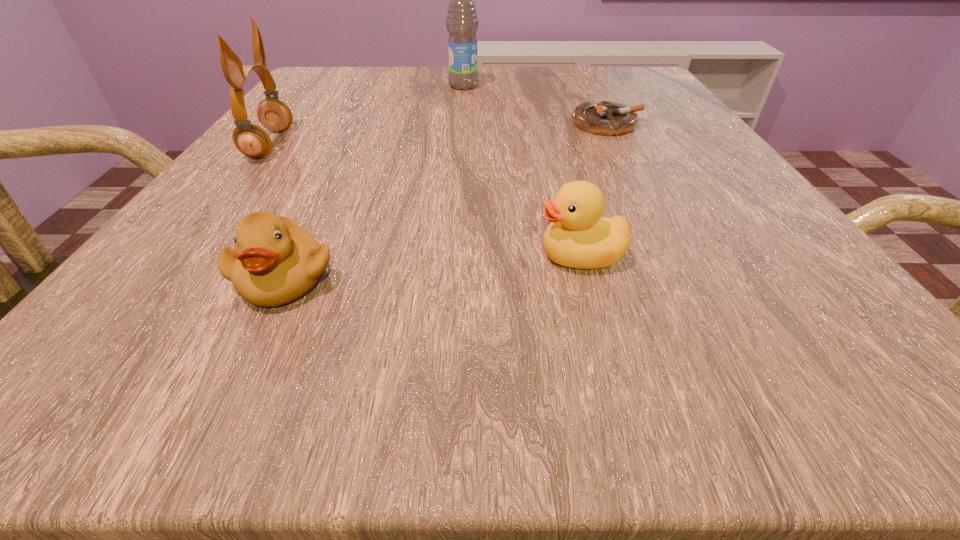
Find the location of a particular element. This screenshot has height=540, width=960. vacant space at the right edge of the desktop is located at coordinates click(730, 167).

I want to click on vacant space at the far right corner, so click(616, 76).

This screenshot has height=540, width=960. Identify the location of free spot at the near right corner of the desktop. (729, 339).

Locate an element on the screen. The image size is (960, 540). vacant space that is in between the duckling and the leftmost object is located at coordinates (276, 211).

You are a GUI agent. You are given a task and a screenshot of the screen. Output one action in this format:
    pyautogui.click(x=<x>, y=<y>)
    Task: Click on the vacant point located between the duck and the earphone
    This screenshot has height=540, width=960.
    Given the screenshot: What is the action you would take?
    pyautogui.click(x=425, y=200)

What are the coordinates of `vacant area that lies between the third object from left to right and the duck` in the screenshot? It's located at pyautogui.click(x=521, y=171).

Locate an element on the screen. The height and width of the screenshot is (540, 960). blank region between the duckling and the duck is located at coordinates (432, 266).

What are the coordinates of `empty space that is in between the duckling and the ashtray` in the screenshot? It's located at (445, 200).

Identify the location of free space between the fourth object from right to left and the water bottle. (373, 182).

In order to click on unoccupied area between the earphone and the ashtray in this screenshot , I will do `click(439, 133)`.